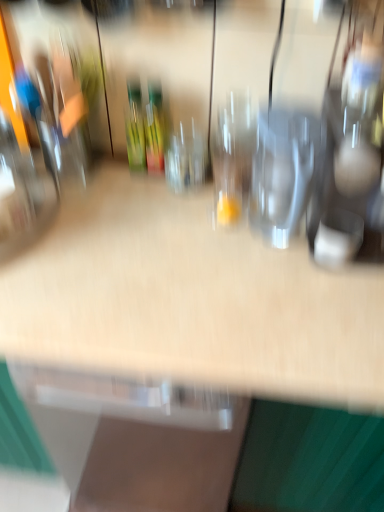
Image resolution: width=384 pixels, height=512 pixels. I want to click on vacant area that is in front of transparent glass wine glass at center, which is the 3th wine glass from right to left, so click(x=170, y=219).